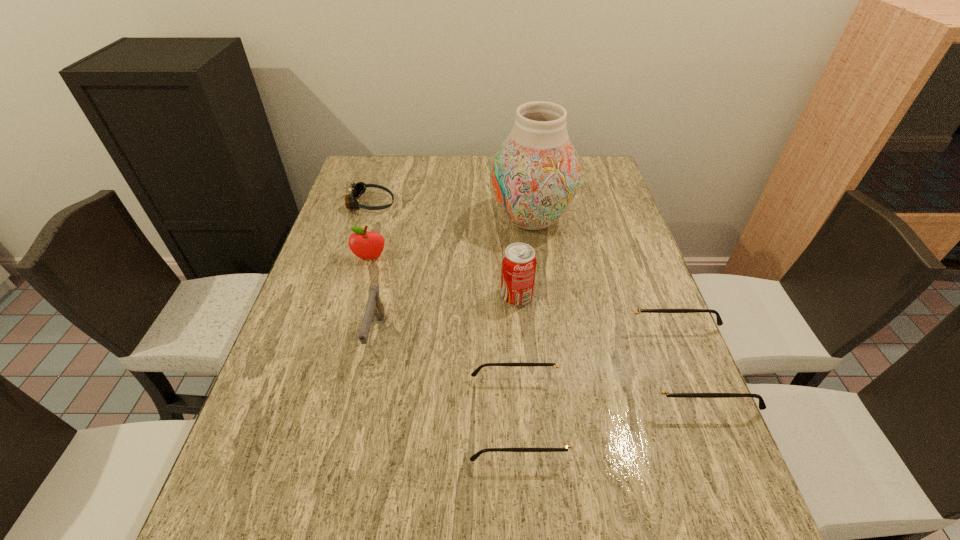
Identify the location of vacant space at the near left corner of the desktop. (300, 463).

In the image, there is a desktop. At what (x,y) coordinates should I click in order to perform the action: click on free region at the far right corner. Please return your answer as a coordinate pair (x, y). This screenshot has height=540, width=960. Looking at the image, I should click on (582, 158).

Identify the location of vacant space that is in between the goggles and the left spectacles. Image resolution: width=960 pixels, height=540 pixels. (444, 310).

Image resolution: width=960 pixels, height=540 pixels. Identify the location of free space between the rightmost object and the fifth nearest object. (529, 313).

The height and width of the screenshot is (540, 960). I want to click on empty space that is in between the pistol and the goggles, so click(x=373, y=269).

You are a GUI agent. You are given a task and a screenshot of the screen. Output one action in this format:
    pyautogui.click(x=<x>, y=<y>)
    Task: Click on the vacant space that's between the tallest object and the fifth nearest object
    
    Given the screenshot: What is the action you would take?
    pyautogui.click(x=450, y=239)

This screenshot has width=960, height=540. I want to click on blank region between the fourth nearest object and the third object from left to right, so click(446, 316).

This screenshot has width=960, height=540. I want to click on vacant area that lies between the shorter spectacles and the fifth nearest object, so click(444, 338).

Locate an element on the screen. The image size is (960, 540). free spot between the left spectacles and the taller spectacles is located at coordinates (603, 393).

Locate an element on the screen. The height and width of the screenshot is (540, 960). unoccupied position between the left spectacles and the tallest object is located at coordinates pos(524,319).